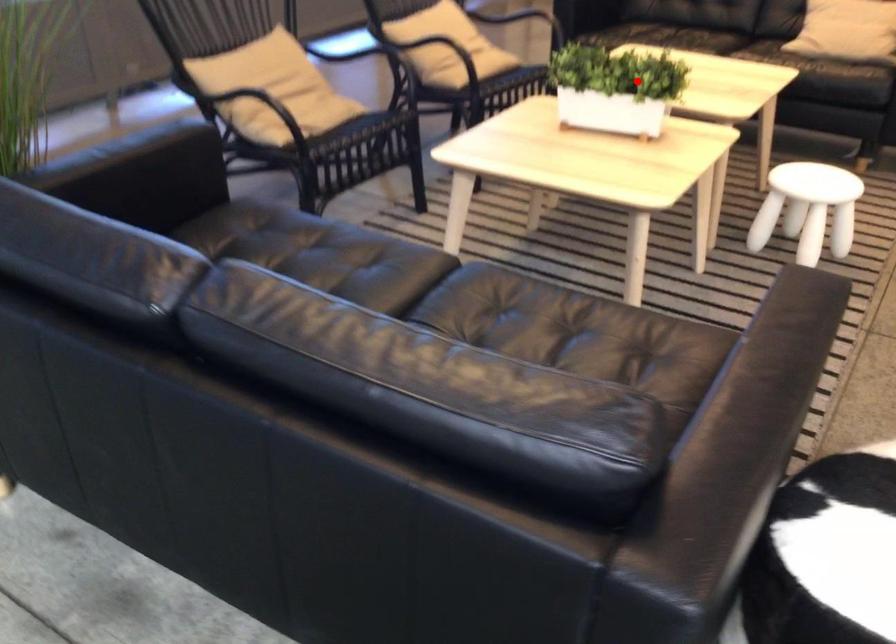
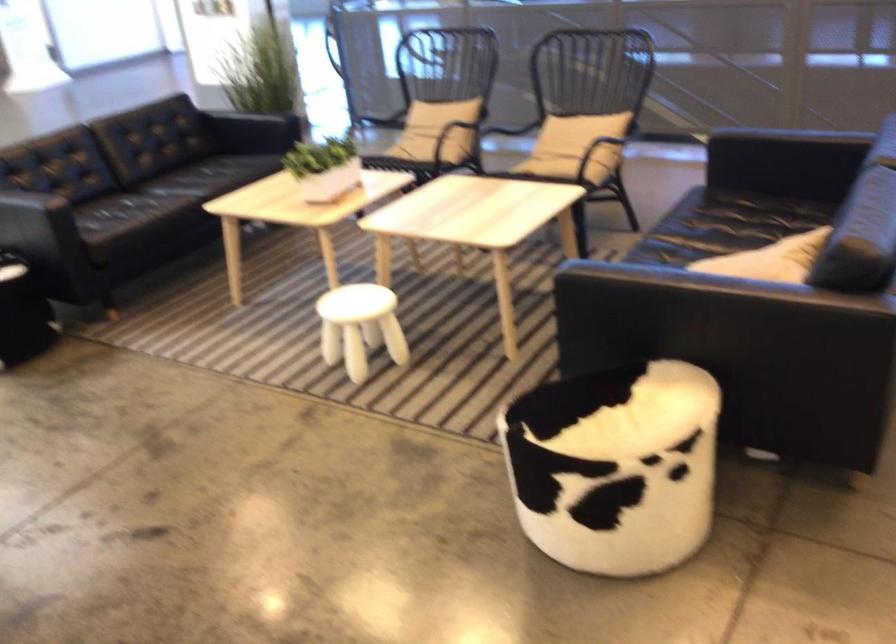
Question: I am providing you with two images of the same scene from different viewpoints. Given a red point in image1, look at the same physical point in image2. Is it:

Choices:
 (A) Closer to the viewpoint
 (B) Farther from the viewpoint

Answer: (B)